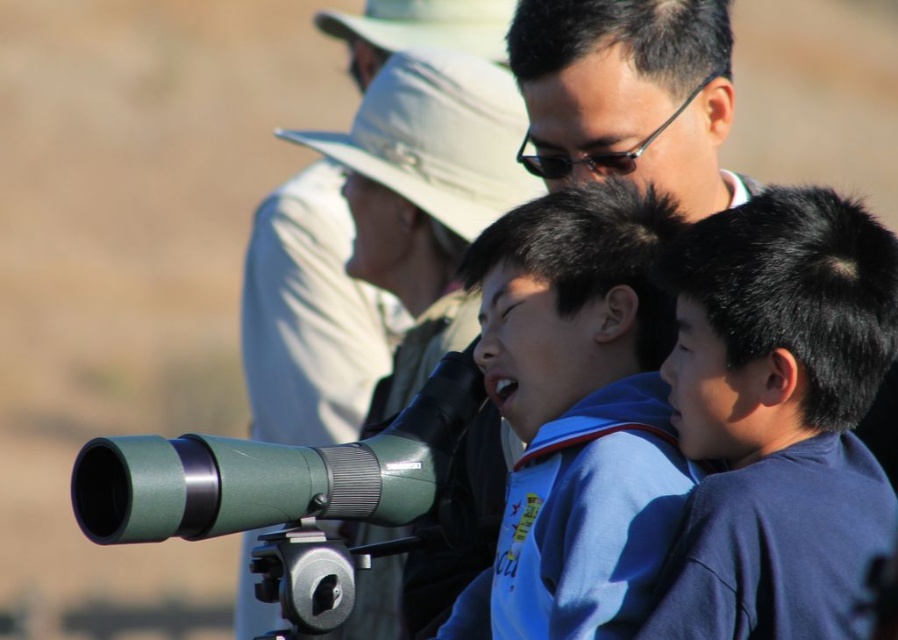
You are a nature guide leading a group of children. You have two binoculars available for the kids to use. The matte black binoculars at center and the green rubber binoculars at center. Which binoculars are wider?

The green rubber binoculars at center are wider than the matte black binoculars at center.